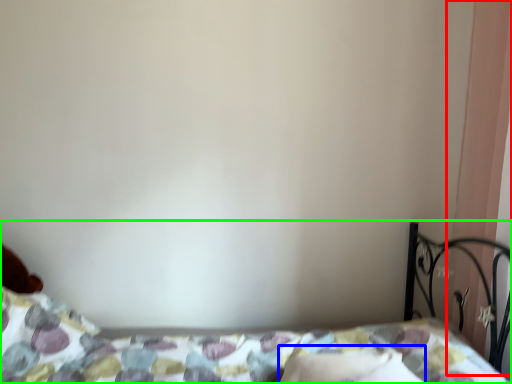
Question: Considering the real-world distances, which object is closest to curtain (highlighted by a red box)? pillow (highlighted by a blue box) or bed (highlighted by a green box).

Choices:
 (A) pillow
 (B) bed

Answer: (A)